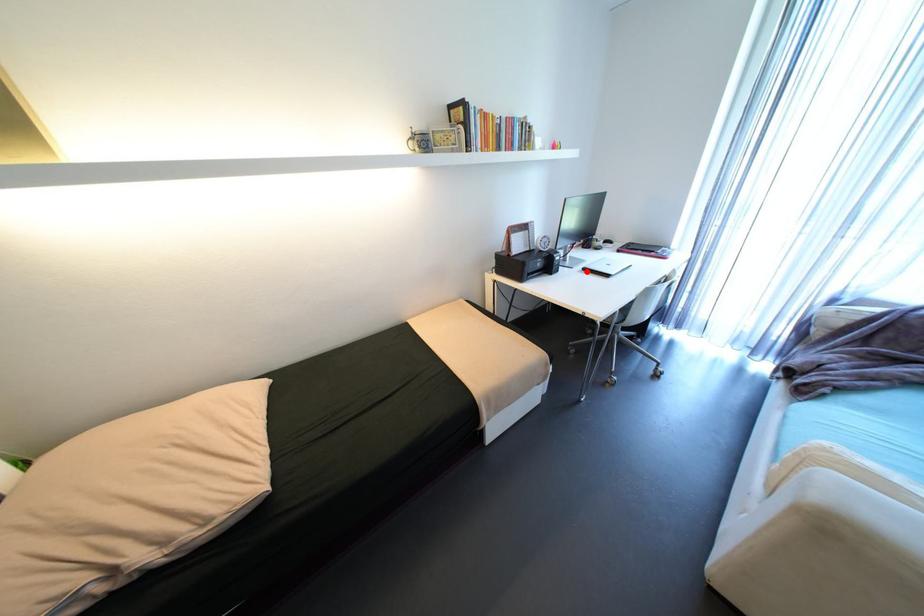
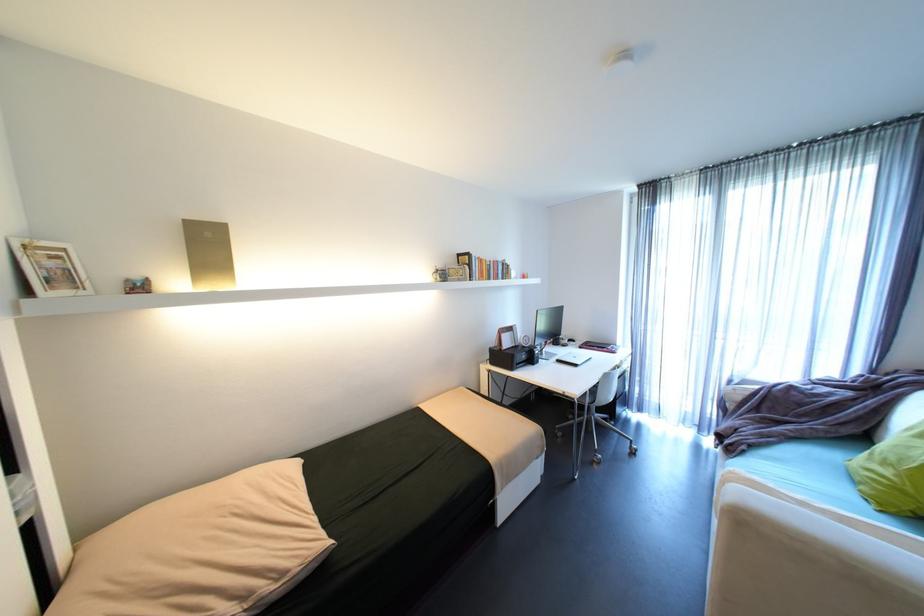
Question: I am providing you with two images of the same scene from different viewpoints. In image1, a red point is highlighted. Considering the same 3D point in image2, which of the following is correct?

Choices:
 (A) It is closer
 (B) It is farther

Answer: (B)